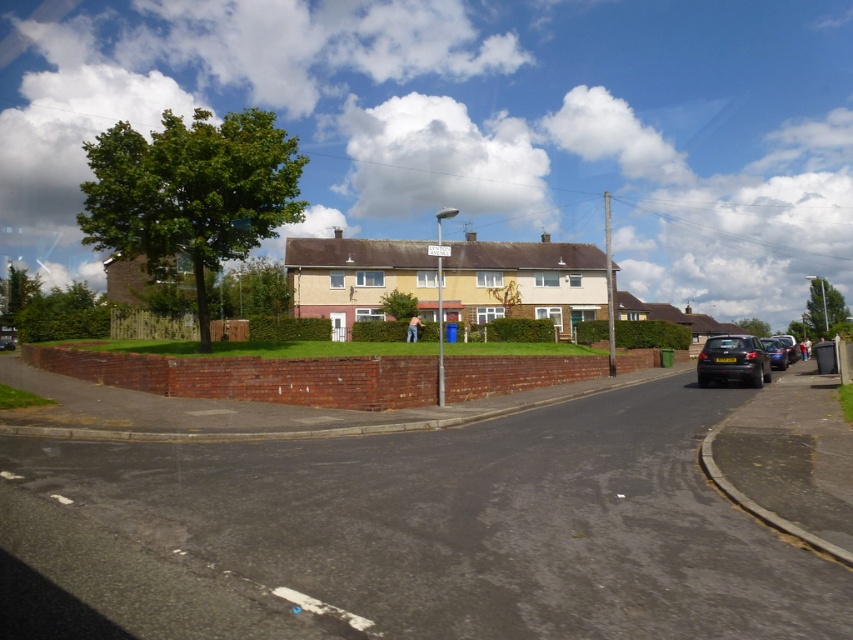
Is shiny black car at lower right to the left of shiny metallic car at right from the viewer's perspective?

Yes, shiny black car at lower right is to the left of shiny metallic car at right.

Does shiny black car at lower right have a larger size compared to shiny metallic car at right?

Actually, shiny black car at lower right might be smaller than shiny metallic car at right.

Is point (747, 372) less distant than point (784, 365)?

That is True.

Locate an element on the screen. The width and height of the screenshot is (853, 640). shiny black car at lower right is located at coordinates (733, 360).